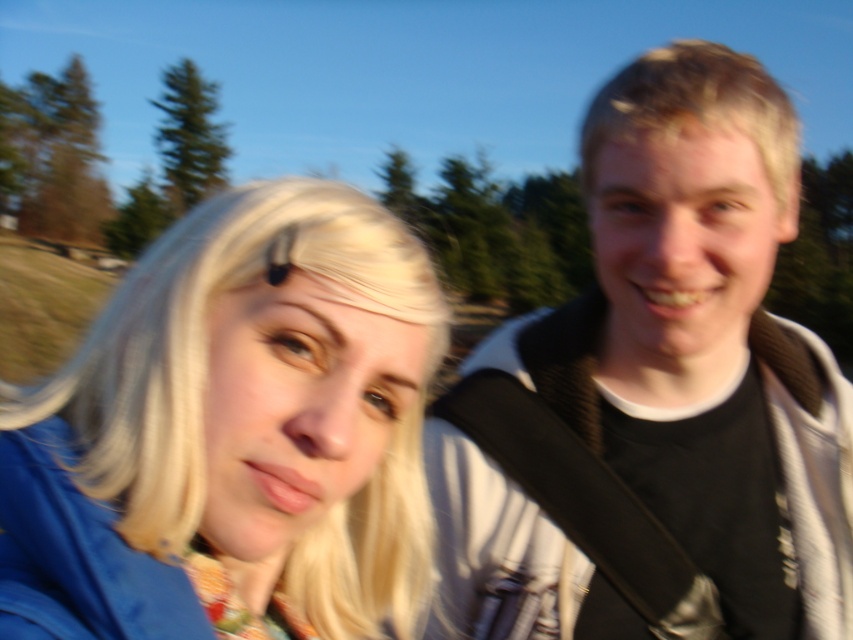
You are a photographer trying to capture a photo of the two people in the scene. You want to ensure that both the black cotton shirt at right and the blonde hair at left are clearly visible in the frame. Based on their positions, which object is closer to the camera, making it more prominent in the photo?

The black cotton shirt at right is positioned over blonde hair at left, so the black cotton shirt at right is closer to the camera and will appear more prominent in the photo.

You are a photographer trying to capture a group photo of the two people in the scene. Since you want to ensure that both subjects are clearly visible, you need to know which clothing item is wider. Which is wider between the black cotton shirt at right and the blonde hair at left?

The black cotton shirt at right is wider than the blonde hair at left according to the description.